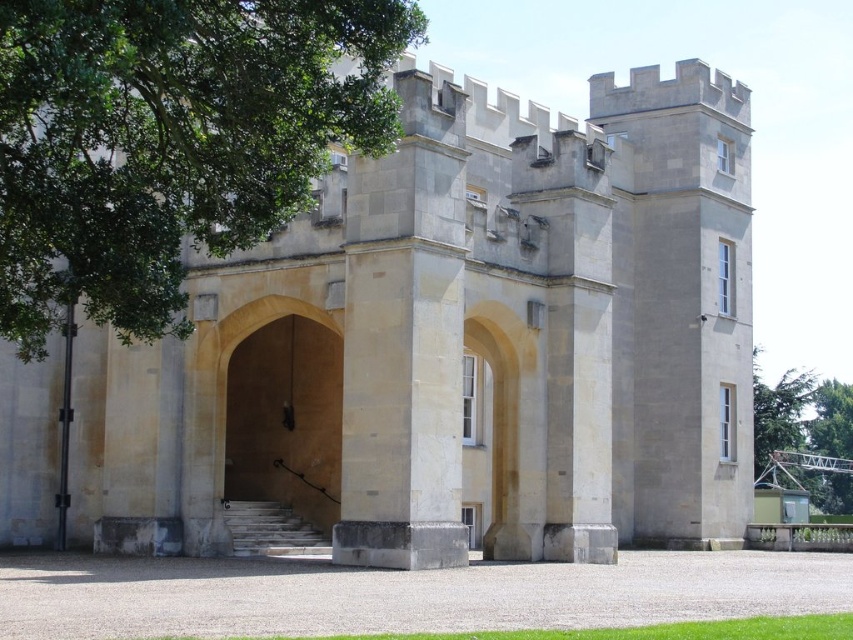
You are standing in front of the grand structure and want to take a photo of the beige stone archway at center without the green leafy tree at upper right appearing in the shot. Is this possible given their positions?

The beige stone archway at center is in front of the green leafy tree at upper right, so taking a photo of the beige stone archway at center without the green leafy tree at upper right would require adjusting the angle or zoom to exclude the tree since it is behind the archway.